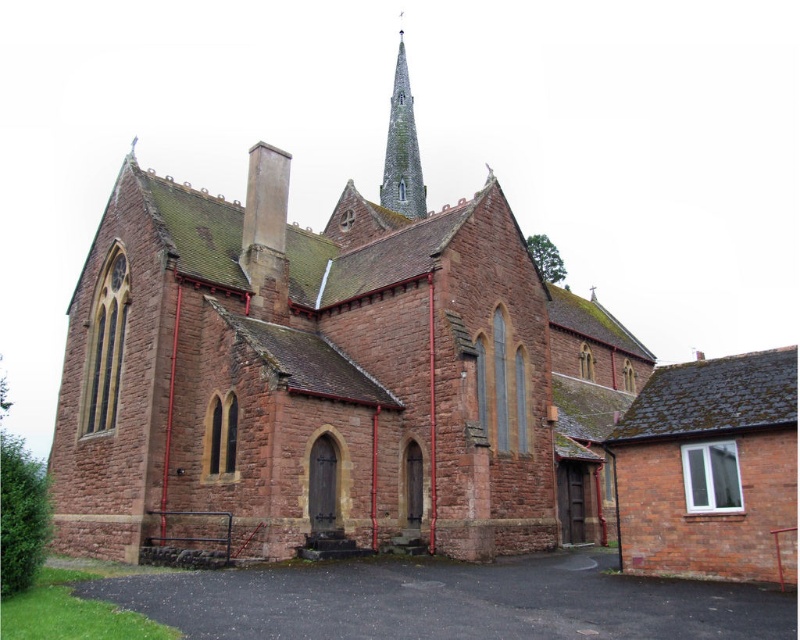
You are standing in front of the church and want to take a photo that includes both the brown stone chapel at center and the gray stone spire at upper center. Which object should you focus on first to ensure both are in frame?

The brown stone chapel at center is larger in size compared to the gray stone spire at upper center, so you should focus on the brown stone chapel at center first to ensure both are in frame.